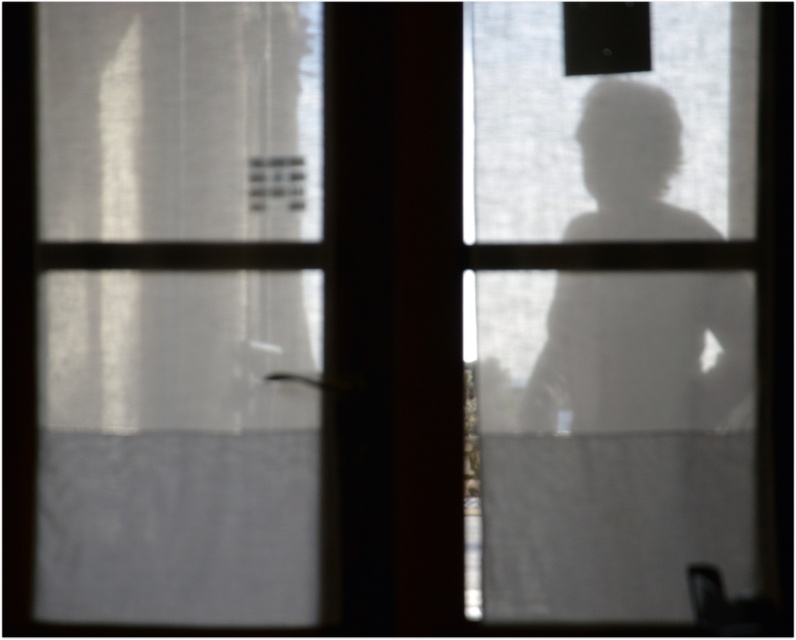
Question: Which of the following is the farthest from the observer?

Choices:
 (A) transparent glass figure at right
 (B) satin white curtain at left

Answer: (B)

Question: Does satin white curtain at left have a greater width compared to transparent glass figure at right?

Choices:
 (A) yes
 (B) no

Answer: (B)

Question: Is satin white curtain at left positioned behind transparent glass figure at right?

Choices:
 (A) yes
 (B) no

Answer: (A)

Question: Which object appears farthest from the camera in this image?

Choices:
 (A) transparent glass figure at right
 (B) satin white curtain at left

Answer: (B)

Question: Does satin white curtain at left lie in front of transparent glass figure at right?

Choices:
 (A) yes
 (B) no

Answer: (B)